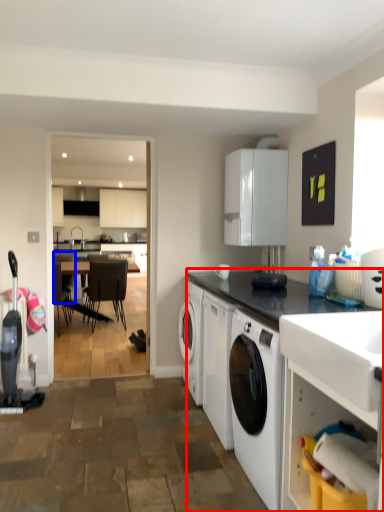
Question: Which of the following is the closest to the observer, countertop (highlighted by a red box) or chair (highlighted by a blue box)?

Choices:
 (A) countertop
 (B) chair

Answer: (A)